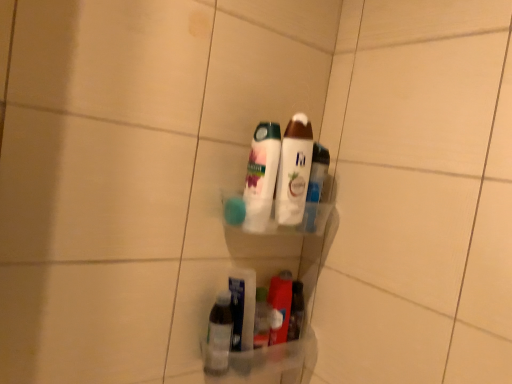
Question: Does clear plastic bottle at lower center, the 3th bottle positioned from the top, come in front of translucent plastic bottles at center, positioned as the 2th bottle in bottom-to-top order?

Choices:
 (A) no
 (B) yes

Answer: (A)

Question: Is clear plastic bottle at lower center, the 3th bottle positioned from the top, in contact with translucent plastic bottles at center, positioned as the 2th bottle in bottom-to-top order?

Choices:
 (A) yes
 (B) no

Answer: (B)

Question: Is clear plastic bottle at lower center, the 3th bottle positioned from the top, wider than translucent plastic bottles at center, positioned as the 2th bottle in bottom-to-top order?

Choices:
 (A) no
 (B) yes

Answer: (A)

Question: Can you confirm if clear plastic bottle at lower center, which is counted as the 1th bottle, starting from the bottom, is shorter than translucent plastic bottles at center, positioned as the second bottle in top-to-bottom order?

Choices:
 (A) no
 (B) yes

Answer: (B)

Question: From the image's perspective, does clear plastic bottle at lower center, the 3th bottle positioned from the top, appear higher than translucent plastic bottles at center, positioned as the 2th bottle in bottom-to-top order?

Choices:
 (A) yes
 (B) no

Answer: (B)

Question: From the image's perspective, is clear plastic bottle at lower center, the 3th bottle positioned from the top, positioned above or below translucent plastic bottles at center, positioned as the second bottle in top-to-bottom order?

Choices:
 (A) above
 (B) below

Answer: (B)

Question: Considering the positions of clear plastic bottle at lower center, which is counted as the 1th bottle, starting from the bottom, and translucent plastic bottles at center, positioned as the second bottle in top-to-bottom order, in the image, is clear plastic bottle at lower center, which is counted as the 1th bottle, starting from the bottom, wider or thinner than translucent plastic bottles at center, positioned as the second bottle in top-to-bottom order,?

Choices:
 (A) wide
 (B) thin

Answer: (B)

Question: From a real-world perspective, is clear plastic bottle at lower center, the 3th bottle positioned from the top, physically located above or below translucent plastic bottles at center, positioned as the second bottle in top-to-bottom order?

Choices:
 (A) below
 (B) above

Answer: (A)

Question: Does point (220, 296) appear closer or farther from the camera than point (270, 170)?

Choices:
 (A) farther
 (B) closer

Answer: (A)

Question: From a real-world perspective, is clear plastic bottle at lower center, the 3th bottle positioned from the top, physically located above or below white glossy lotion at center, the third bottle positioned from the bottom?

Choices:
 (A) above
 (B) below

Answer: (B)

Question: Does point (218, 365) appear closer or farther from the camera than point (291, 183)?

Choices:
 (A) farther
 (B) closer

Answer: (B)

Question: In the image, is clear plastic bottle at lower center, which is counted as the 1th bottle, starting from the bottom, on the left side or the right side of white glossy lotion at center, the third bottle positioned from the bottom?

Choices:
 (A) left
 (B) right

Answer: (A)

Question: Considering their positions, is clear plastic bottle at lower center, which is counted as the 1th bottle, starting from the bottom, located in front of or behind white glossy lotion at center, which appears as the 1th bottle when viewed from the top?

Choices:
 (A) front
 (B) behind

Answer: (B)

Question: Do you think white glossy lotion at center, the third bottle positioned from the bottom, is within clear plastic bottle at lower center, which is counted as the 1th bottle, starting from the bottom, or outside of it?

Choices:
 (A) outside
 (B) inside

Answer: (A)

Question: Is white glossy lotion at center, which appears as the 1th bottle when viewed from the top, in front of or behind clear plastic bottle at lower center, which is counted as the 1th bottle, starting from the bottom, in the image?

Choices:
 (A) front
 (B) behind

Answer: (A)